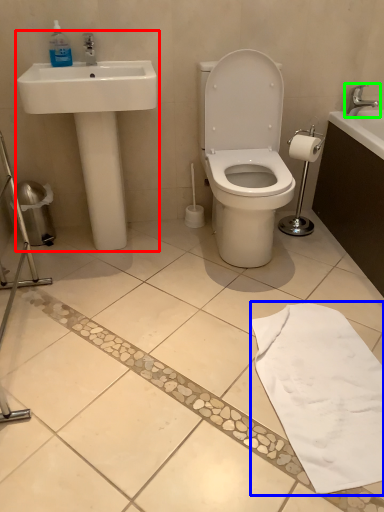
Question: Which object is positioned closest to sink (highlighted by a red box)? Select from bath towel (highlighted by a blue box) and tap (highlighted by a green box).

Choices:
 (A) bath towel
 (B) tap

Answer: (A)